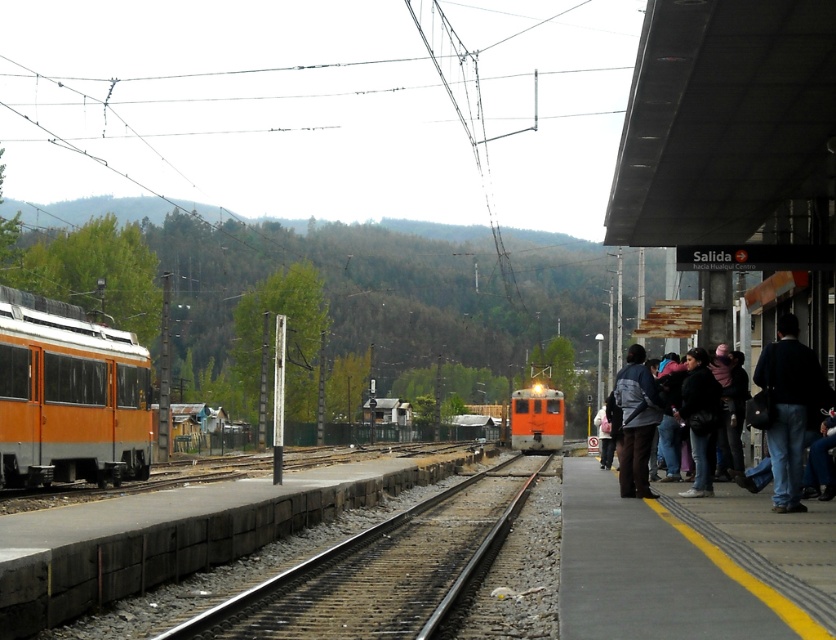
You are standing at the camera position in the train station scene. There is a point marked at coordinates point (319, 612). Can you reach this point without moving closer than 10 meters from your current position?

The point (319, 612) is exactly 10.08 meters away from the camera, so you can reach it without moving closer than 10 meters since it is just slightly beyond the 10 meter threshold.

You are a maintenance worker who needs to inspect the distance between the smooth concrete train track at center and the orange matte train at left. According to safety regulations, the minimum safe distance between a train and the tracks must be at least 10 meters. Is the current distance compliant with safety standards?

The smooth concrete train track at center is 8.97 meters away from the orange matte train at left. Since the required minimum safe distance is 10 meters, the current distance of 8.97 meters is below the safety standard. Therefore, the distance is not compliant with safety regulations.